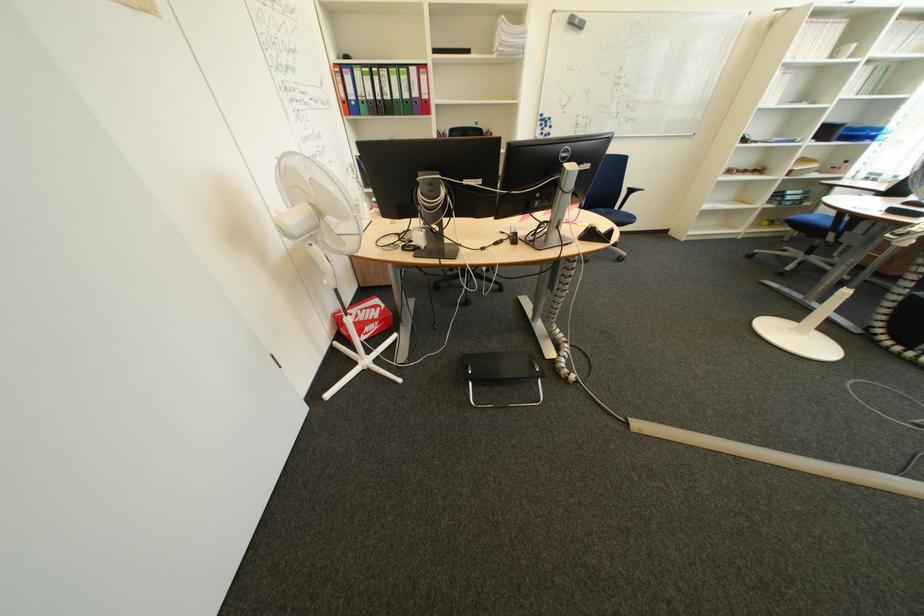
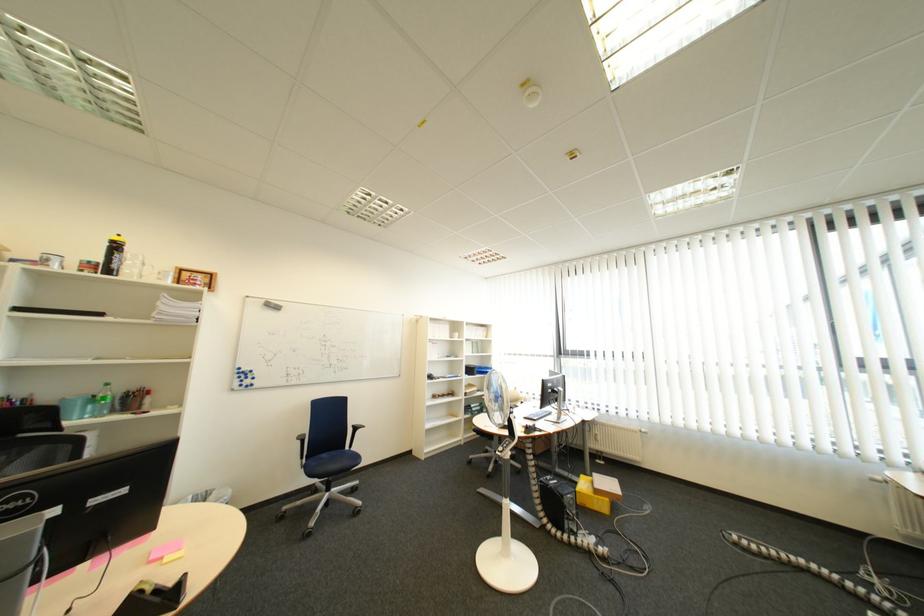
Locate, in the second image, the point that corresponds to the point at 581,28 in the first image.

(277, 309)